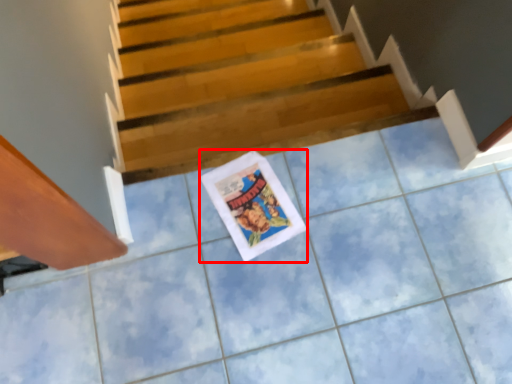
Question: From the image, what is the correct spatial relationship of comic book (annotated by the red box) in relation to stairs?

Choices:
 (A) right
 (B) left

Answer: (B)